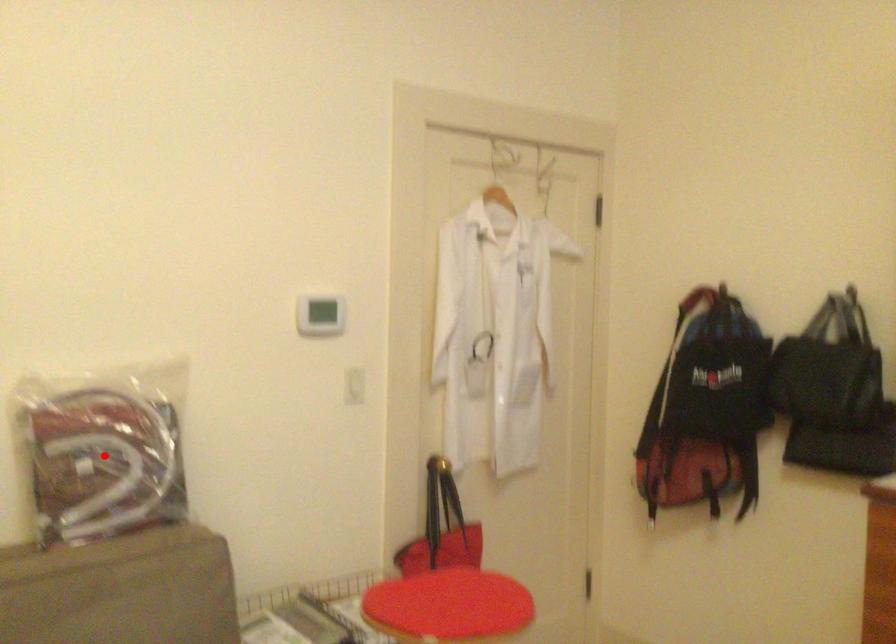
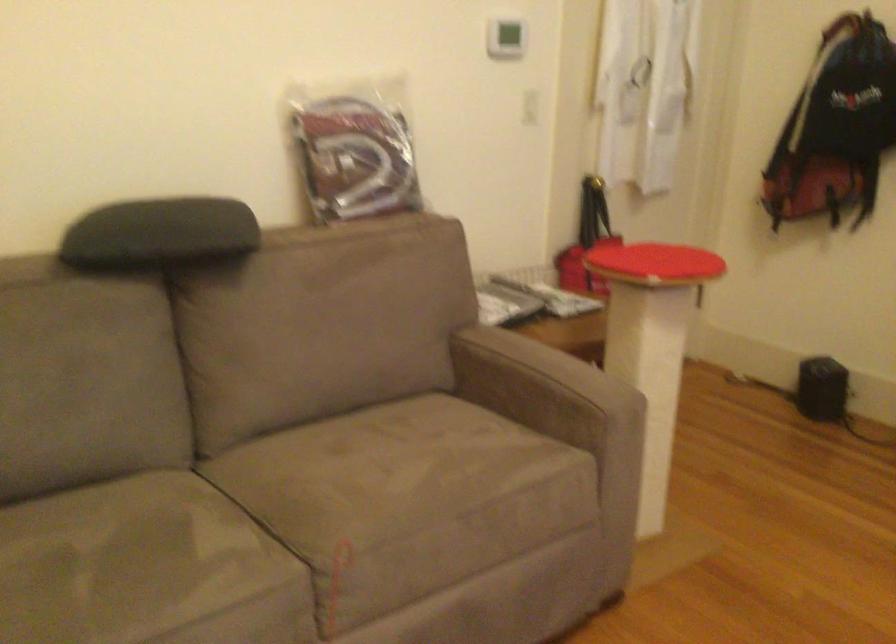
Question: I am providing you with two images of the same scene from different viewpoints. A red point is marked on the first image. Is the red point's position out of view in image 2?

Choices:
 (A) Yes
 (B) No

Answer: (B)